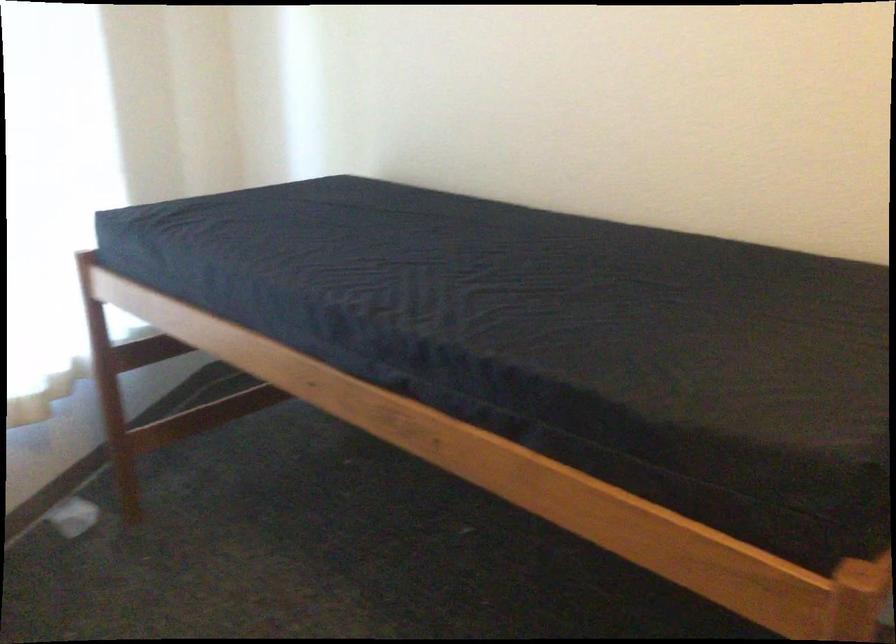
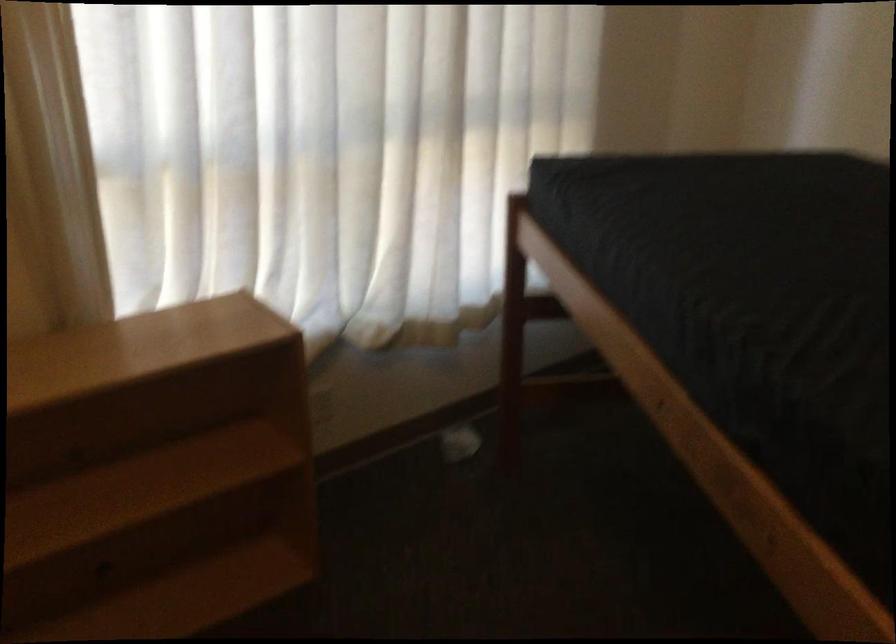
Question: The camera is either moving clockwise (left) or counter-clockwise (right) around the object. The first image is from the beginning of the video and the second image is from the end. Is the camera moving left or right when shooting the video?

Choices:
 (A) Left
 (B) Right

Answer: (B)